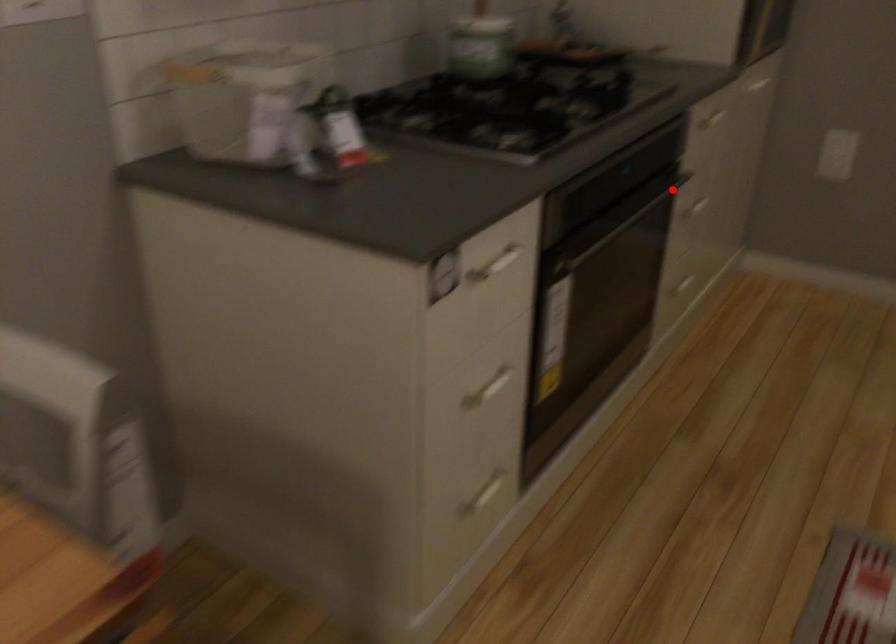
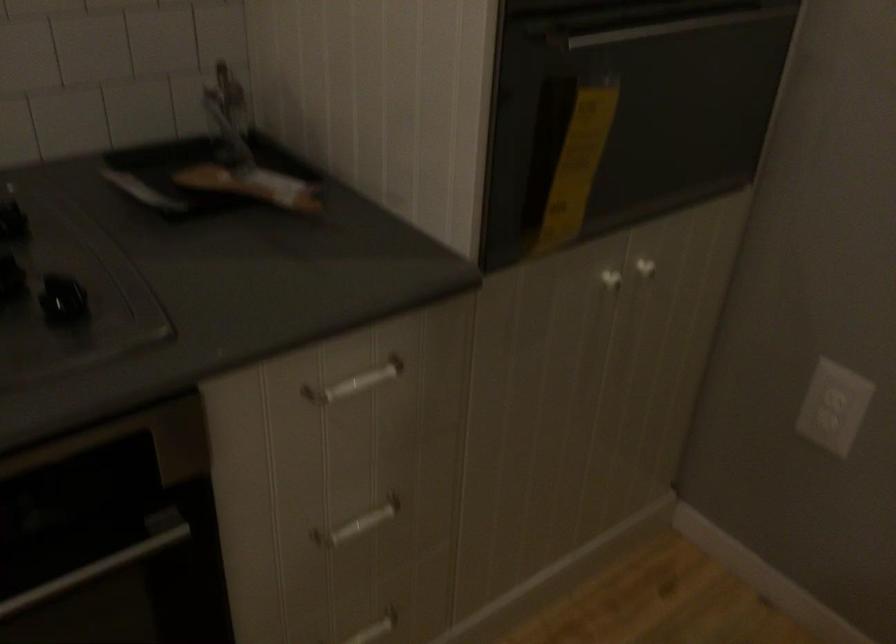
Question: I am providing you with two images of the same scene from different viewpoints. Given a red point in image1, look at the same physical point in image2. Is it:

Choices:
 (A) Closer to the viewpoint
 (B) Farther from the viewpoint

Answer: (A)